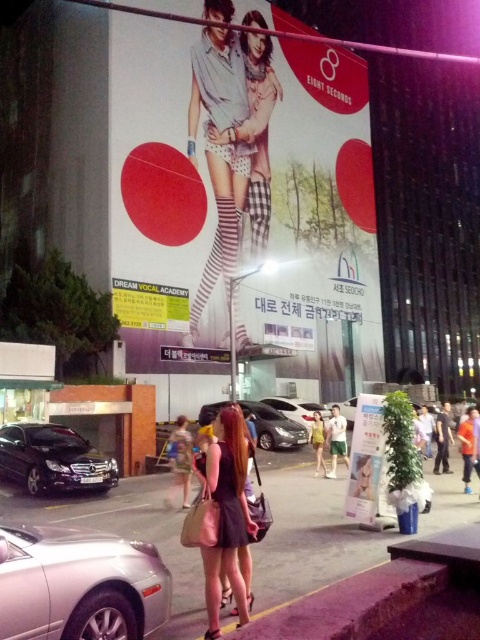
Question: Does silver metallic car at lower left appear over satin silver sedan at center?

Choices:
 (A) yes
 (B) no

Answer: (A)

Question: Based on their relative distances, which object is nearer to the matte purple dress at center?

Choices:
 (A) satin silver sedan at center
 (B) purple asphalt at lower left
 (C) green fabric dress at center

Answer: (B)

Question: Which of the following is the closest to the observer?

Choices:
 (A) green fabric dress at center
 (B) silver metallic car at lower left

Answer: (B)

Question: Can you confirm if satin silver sedan at center is bigger than sleek silver sedan at center?

Choices:
 (A) no
 (B) yes

Answer: (B)

Question: Among these points, which one is nearest to the camera?

Choices:
 (A) pyautogui.click(x=91, y=580)
 (B) pyautogui.click(x=272, y=397)
 (C) pyautogui.click(x=321, y=419)

Answer: (A)

Question: Does silver metallic car at lower left have a smaller size compared to matte purple dress at center?

Choices:
 (A) yes
 (B) no

Answer: (B)